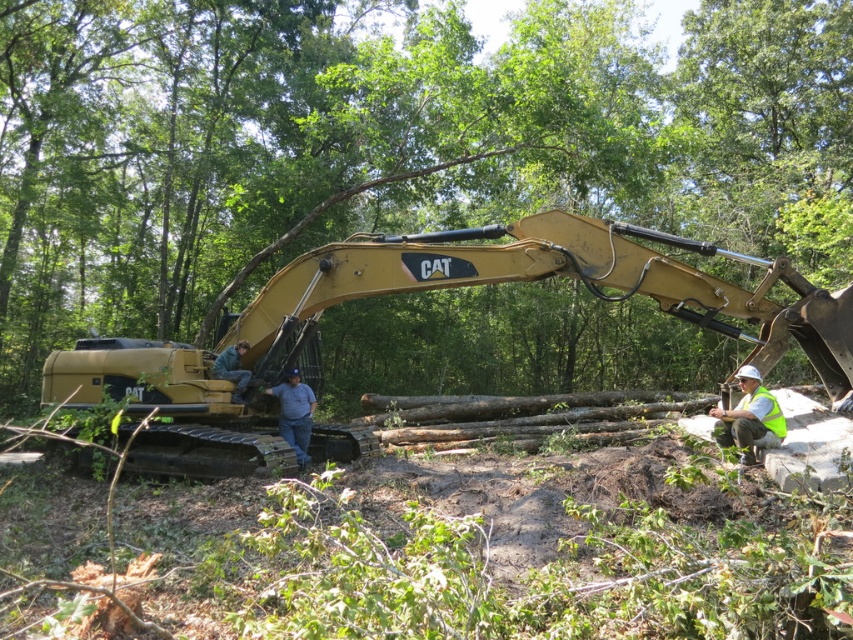
Based on the photo, you are standing at the origin point of the coordinate system. The excavator operator needs to move the smooth brown log at center to a new location. Which direction should they move it to reach the point with coordinates higher than 0.225 in the x and y axes?

The smooth brown log at center is currently at point 0.225 in the x and 0.455 in the y. To reach coordinates higher than both, it needs to be moved to the northeast direction, increasing both x and y values.

You are a safety inspector evaluating the scene. The matte yellow excavator at center and the blue denim jeans at center are both in the same area. According to safety protocols, which object should be prioritized for inspection based on their relative heights?

The blue denim jeans at center should be prioritized for inspection because the matte yellow excavator at center is shorter than it, meaning the jeans might belong to a worker in a hazardous position near the machinery.